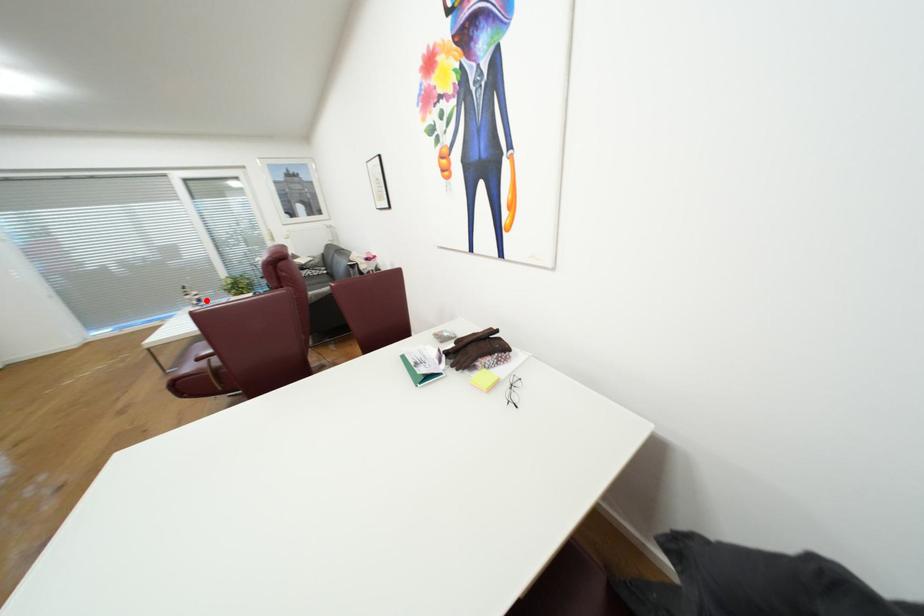
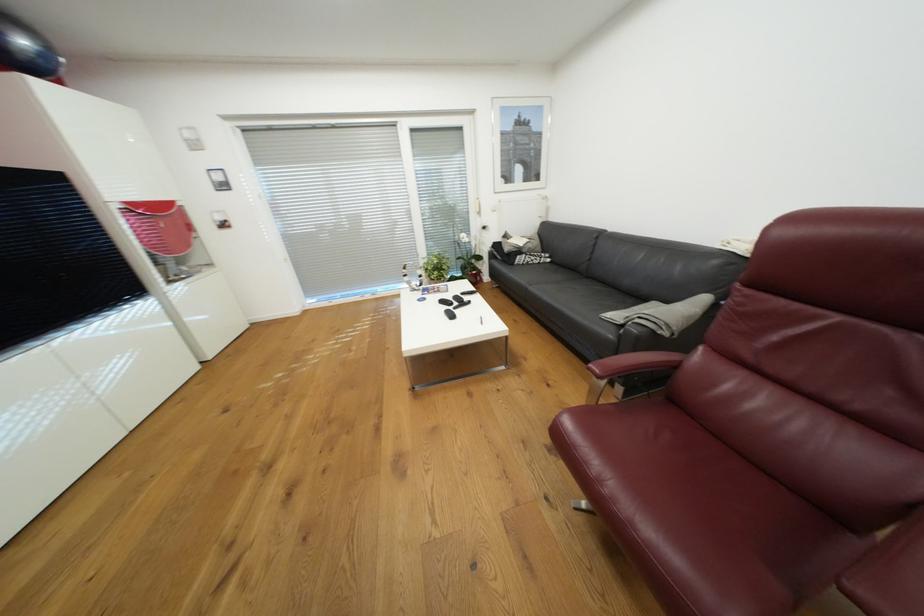
Locate, in the second image, the point that corresponds to the highlighted location in the first image.

(427, 284)